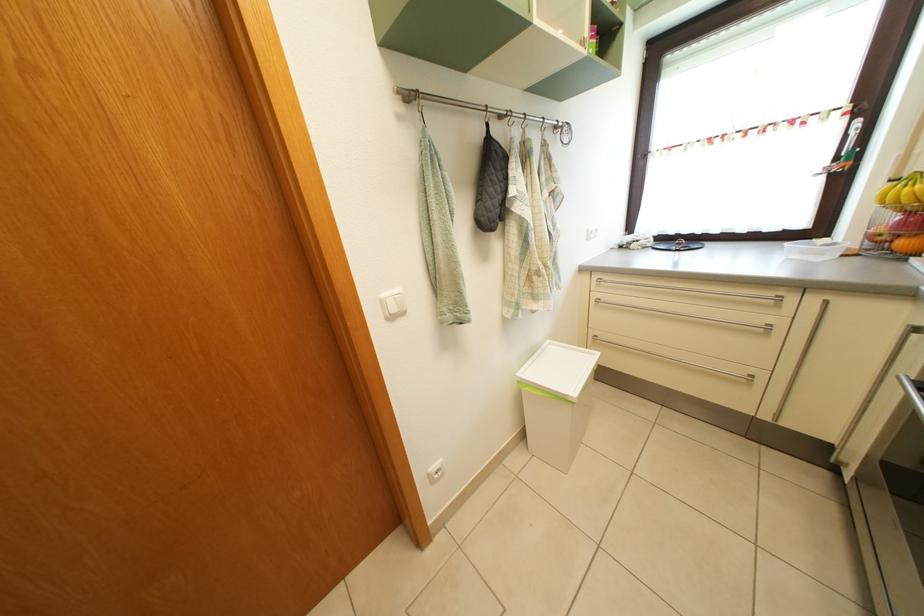
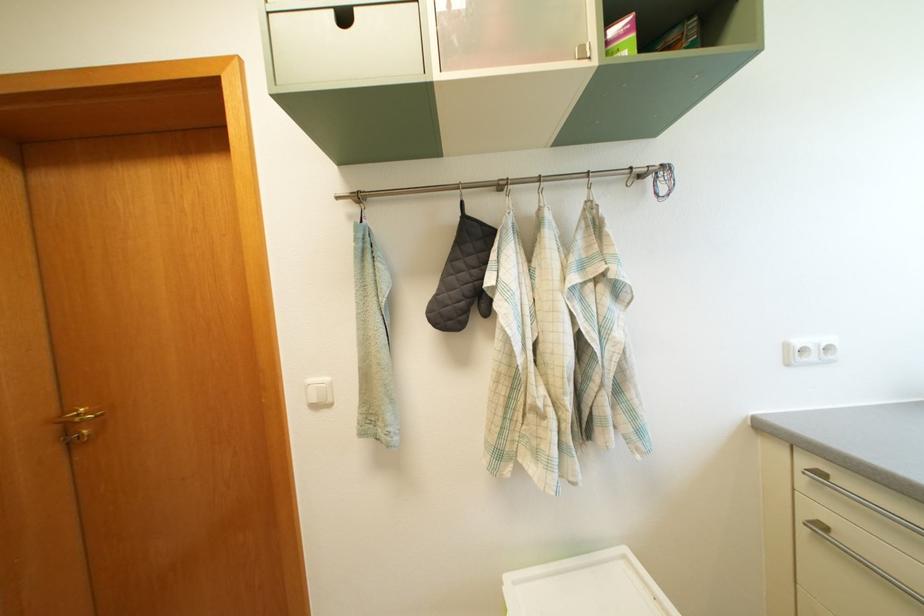
Find the pixel in the second image that matches point (574, 137) in the first image.

(669, 180)